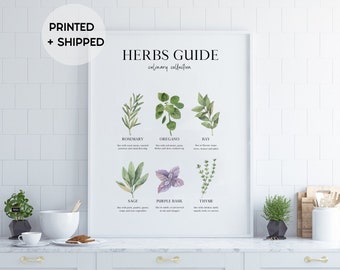
Find the location of a particular element. This screenshot has width=340, height=270. poster is located at coordinates (221, 73).